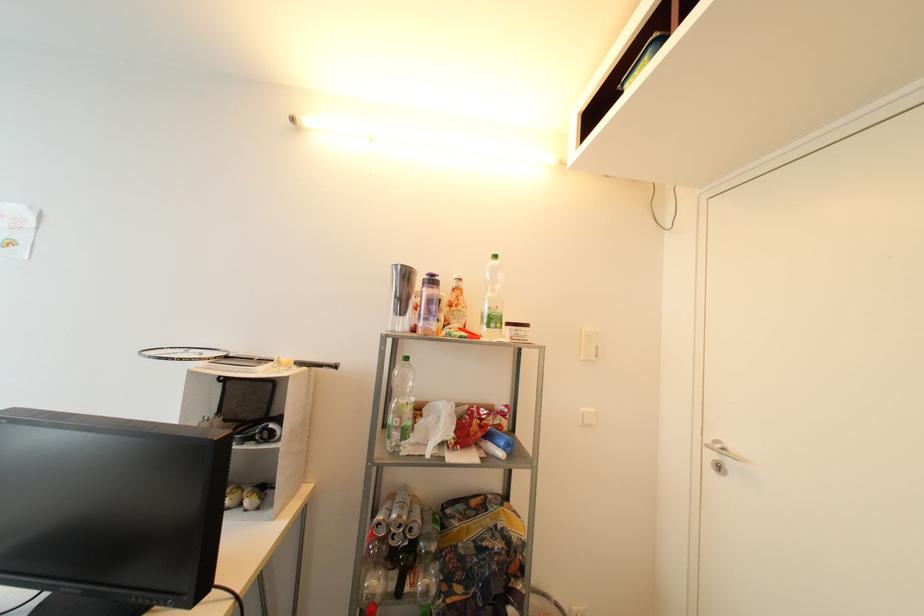
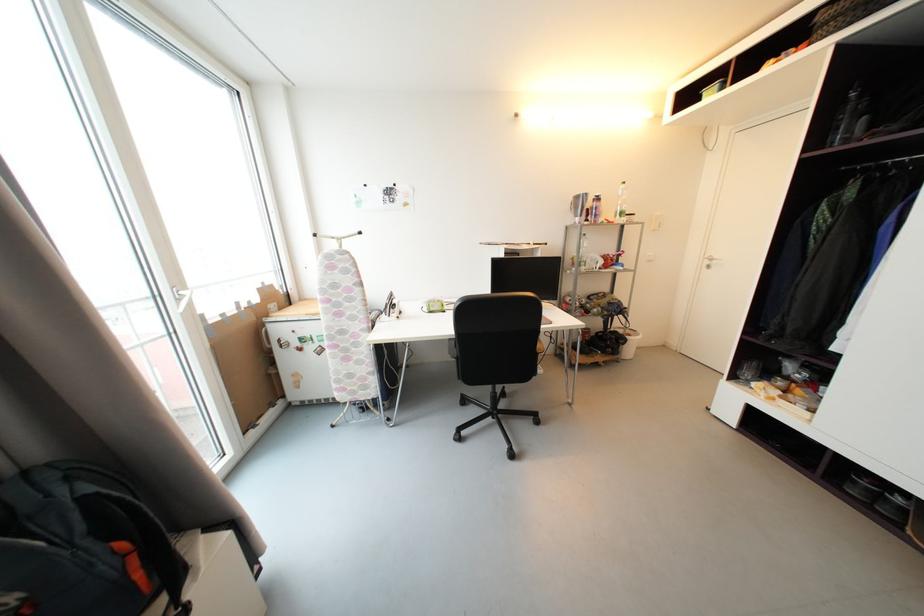
What movement of the cameraman would produce the second image?

The cameraman moved toward left, backward.